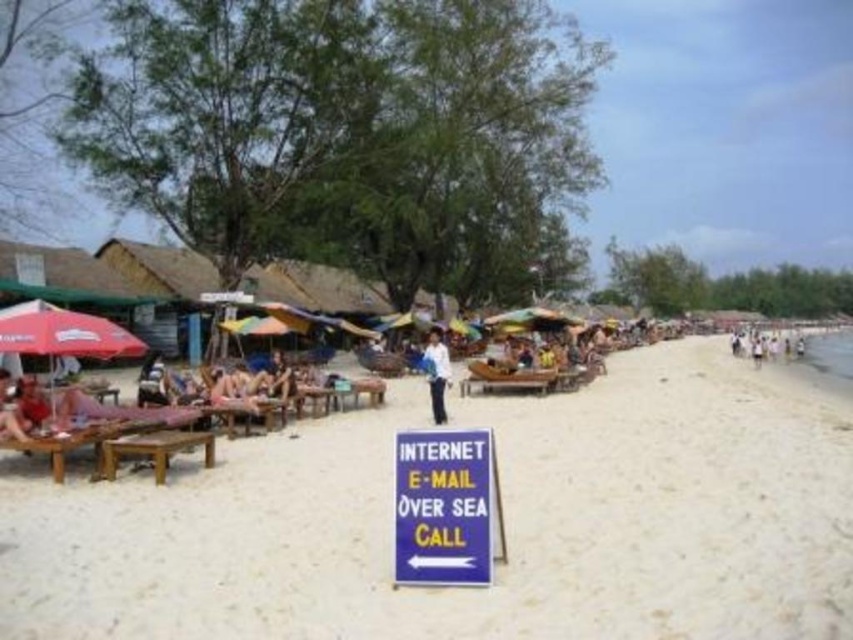
Question: Among these points, which one is nearest to the camera?

Choices:
 (A) (473, 528)
 (B) (32, 342)
 (C) (746, 340)
 (D) (428, 333)

Answer: (A)

Question: Which object is positioned farthest from the red fabric umbrella at left?

Choices:
 (A) white sand at center
 (B) reddish-brown wooden bench at lower left

Answer: (A)

Question: Is blue plastic sign at center wider than white cotton shirt at right?

Choices:
 (A) yes
 (B) no

Answer: (B)

Question: Which point appears closest to the camera in this image?

Choices:
 (A) (444, 346)
 (B) (3, 392)
 (C) (398, 573)
 (D) (784, 337)

Answer: (C)

Question: Where is white fabric shirt at center located in relation to reddish-brown wooden bench at lower left in the image?

Choices:
 (A) left
 (B) right

Answer: (B)

Question: Is white fabric shirt at center above reddish-brown wooden bench at lower left?

Choices:
 (A) no
 (B) yes

Answer: (B)